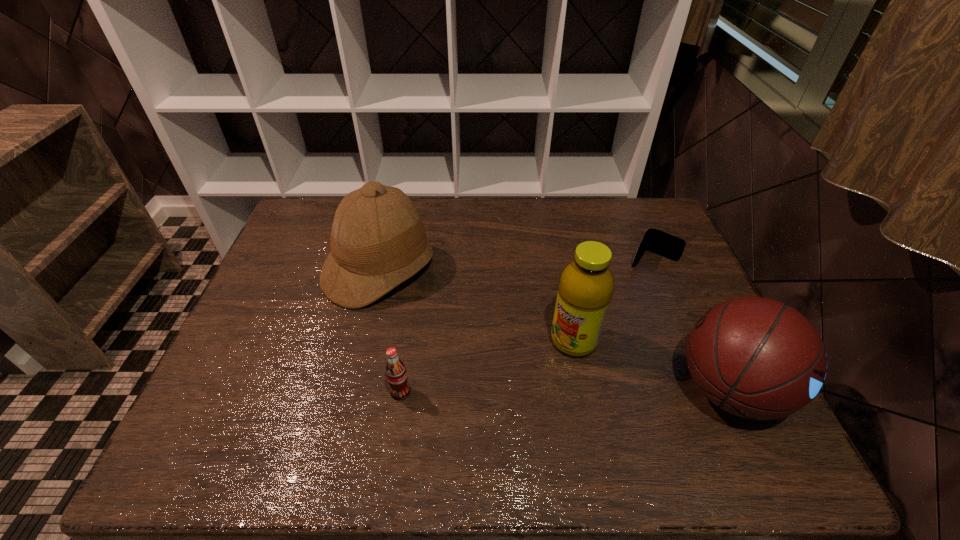
What are the coordinates of `vacant space on the desktop that is between the soda and the basketball and is positioned on the outer surface of the shortest object` in the screenshot? It's located at (579, 390).

Find the location of `vacant space on the desktop that is between the second shortest object and the basketball and is positioned on the front label of the fruit juice`. vacant space on the desktop that is between the second shortest object and the basketball and is positioned on the front label of the fruit juice is located at coordinates (517, 391).

Image resolution: width=960 pixels, height=540 pixels. What are the coordinates of `free space on the desktop that is between the soda and the basketball and is positioned on the front-facing side of the hat` in the screenshot? It's located at (543, 391).